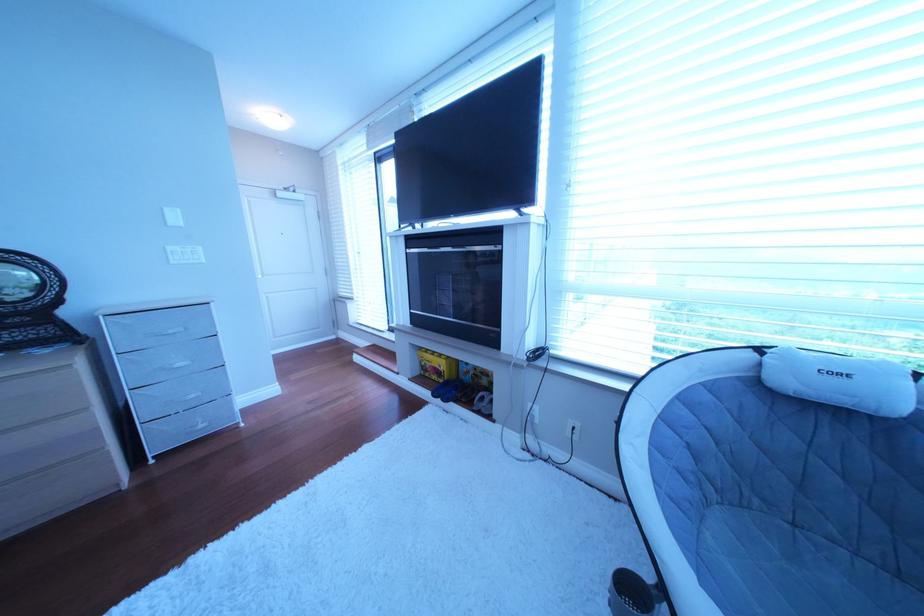
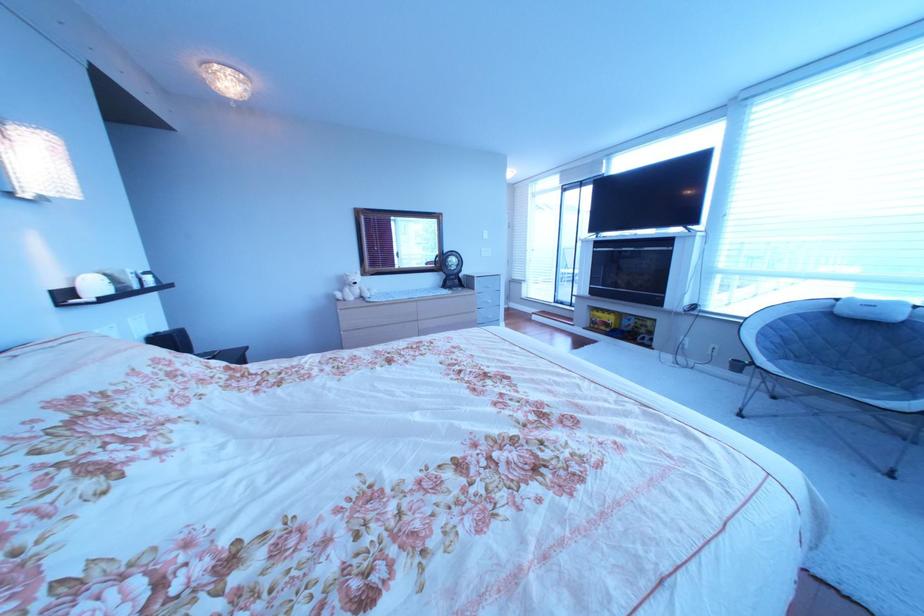
The images are taken continuously from a first-person perspective. In which direction are you moving?

The cameraman walked toward left, backward.